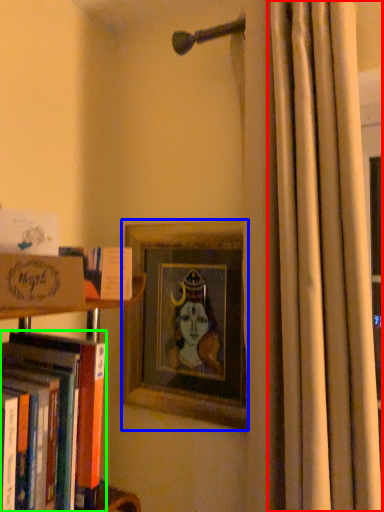
Question: Estimate the real-world distances between objects in this image. Which object is farther from curtain (highlighted by a red box), picture frame (highlighted by a blue box) or book (highlighted by a green box)?

Choices:
 (A) picture frame
 (B) book

Answer: (B)